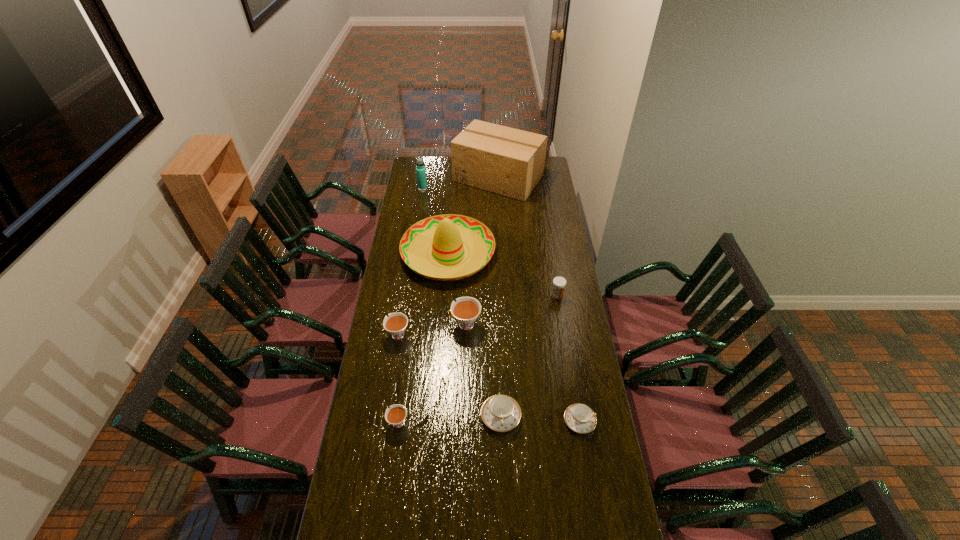
This screenshot has height=540, width=960. In the image, there is a desktop. In order to click on vacant area at the right edge in this screenshot , I will do `click(561, 348)`.

Locate an element on the screen. The height and width of the screenshot is (540, 960). free region at the far left corner of the desktop is located at coordinates (429, 170).

I want to click on empty space between the third farthest object and the medicine, so click(503, 274).

Image resolution: width=960 pixels, height=540 pixels. I want to click on unoccupied area between the tallest object and the rightmost teacup, so click(x=539, y=300).

The width and height of the screenshot is (960, 540). Identify the location of empty space that is in between the white medicine and the smaller blue teacup. (568, 358).

Where is `free spot between the left blue teacup and the second biggest white teacup`? free spot between the left blue teacup and the second biggest white teacup is located at coordinates tap(448, 375).

The image size is (960, 540). In order to click on free spot between the aqua thermos bottle and the nearest white teacup in this screenshot , I will do `click(410, 305)`.

Image resolution: width=960 pixels, height=540 pixels. I want to click on blank region between the sixth nearest object and the box, so pos(528,237).

Identify which object is the eighth nearest to the nearest white teacup. Please provide its 2D coordinates. Your answer should be formatted as a tuple, i.e. [(x, y)], where the tuple contains the x and y coordinates of a point satisfying the conditions above.

[(420, 169)]

Find the location of `object that ranks as the fourth closest to the white medicine`. object that ranks as the fourth closest to the white medicine is located at coordinates (580, 418).